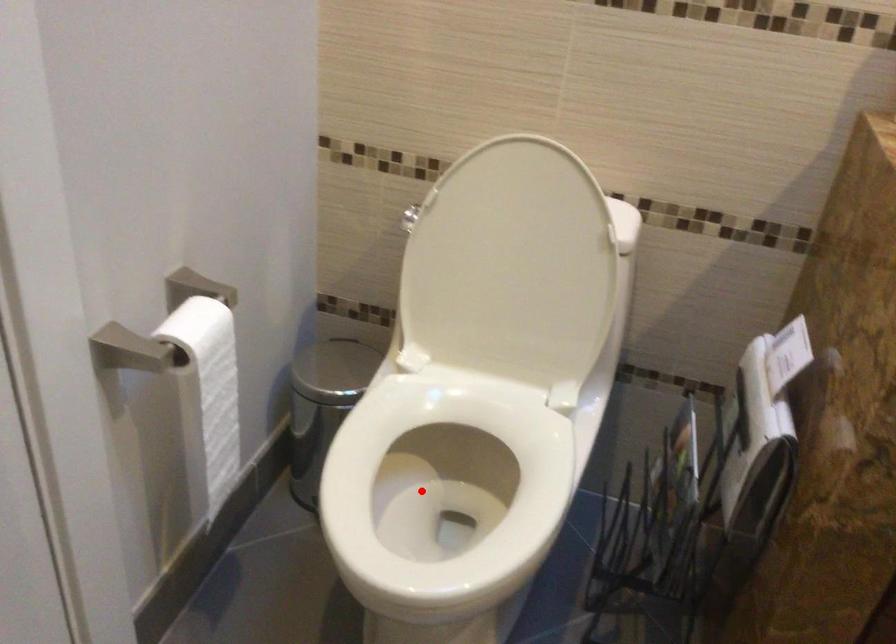
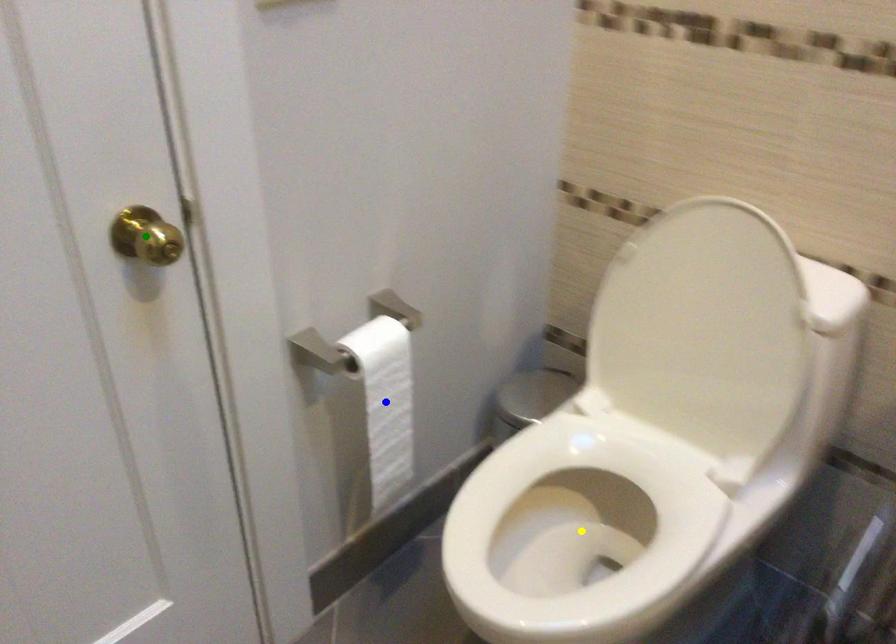
Question: I am providing you with two images of the same scene from different viewpoints. A red point is marked on the first image. You are given multiple points on the second image. Which point in image 2 represents the same 3d spot as the red point in image 1?

Choices:
 (A) green point
 (B) yellow point
 (C) blue point

Answer: (B)